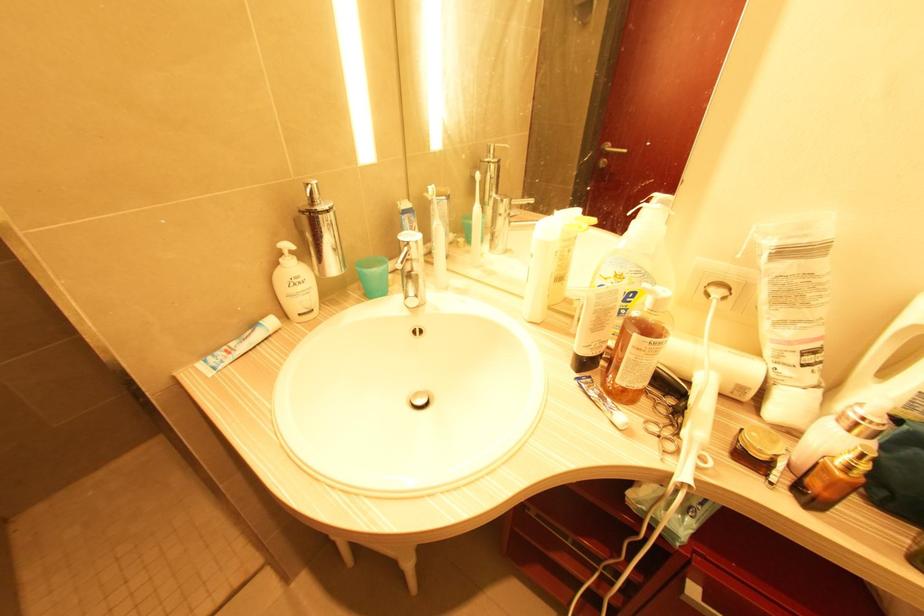
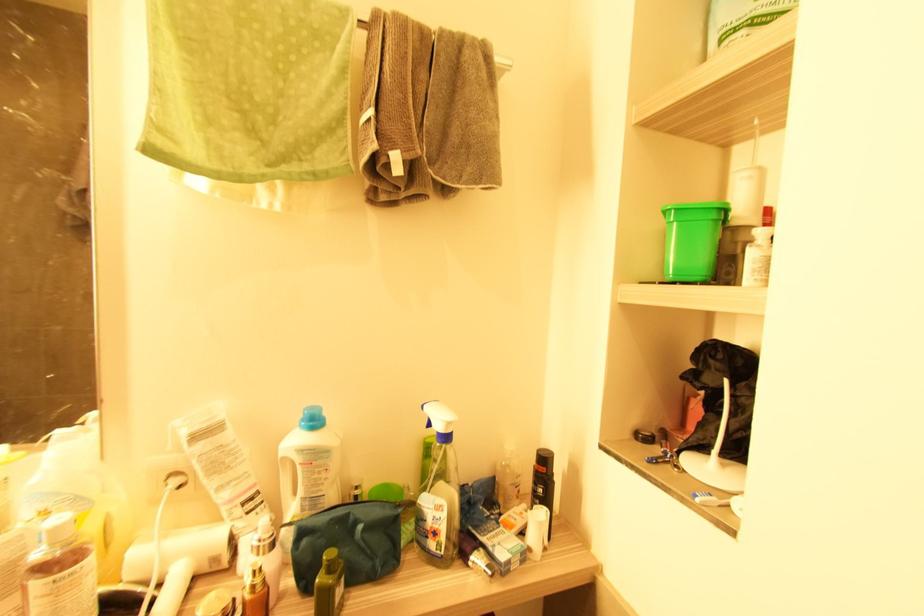
Find the pixel in the second image that matches (x=859, y=424) in the first image.

(261, 546)